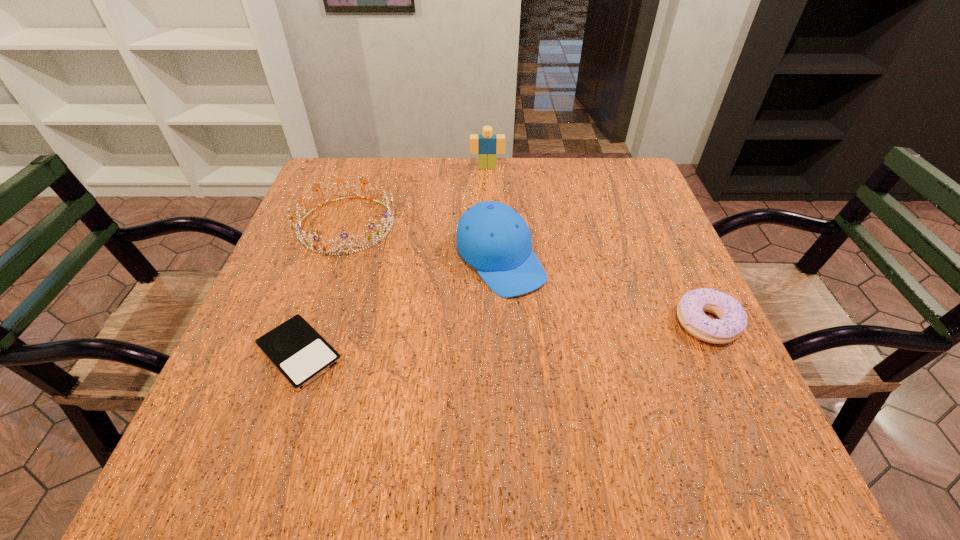
Identify the location of iPod positioned at the left edge. This screenshot has width=960, height=540. (295, 348).

Locate an element on the screen. This screenshot has height=540, width=960. tiara that is at the left edge is located at coordinates (379, 235).

Find the location of `object present at the right edge`. object present at the right edge is located at coordinates (732, 321).

Where is `object present at the far left corner`? This screenshot has width=960, height=540. object present at the far left corner is located at coordinates (379, 235).

Identify the location of object present at the near left corner. The width and height of the screenshot is (960, 540). (295, 348).

At what (x,y) coordinates should I click in order to perform the action: click on vacant space at the far edge. Please return your answer as a coordinate pair (x, y). The width and height of the screenshot is (960, 540). Looking at the image, I should click on (554, 164).

Image resolution: width=960 pixels, height=540 pixels. What are the coordinates of `free space at the near edge of the desktop` in the screenshot? It's located at (569, 388).

Find the location of `vacant space at the left edge`. vacant space at the left edge is located at coordinates (287, 318).

You are a GUI agent. You are given a task and a screenshot of the screen. Output one action in this format:
    pyautogui.click(x=<x>, y=<y>)
    Task: Click on the vacant space at the right edge of the desktop
    Image resolution: width=960 pixels, height=540 pixels.
    Given the screenshot: What is the action you would take?
    pyautogui.click(x=657, y=238)

In order to click on vacant space at the near left corner of the desktop in this screenshot , I will do `click(299, 413)`.